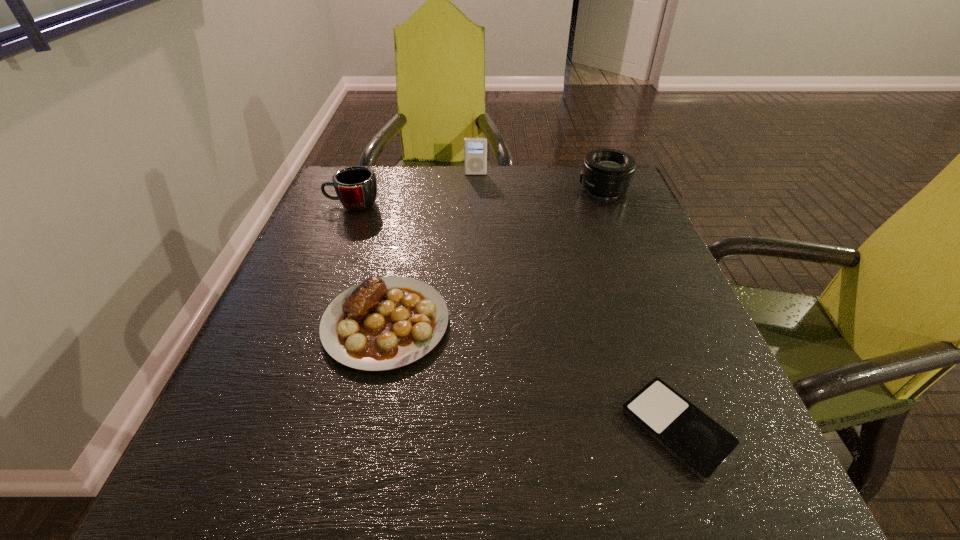
At what (x,y) coordinates should I click in order to perform the action: click on the third object from right to left. Please return your answer as a coordinate pair (x, y). Image resolution: width=960 pixels, height=540 pixels. Looking at the image, I should click on (475, 149).

This screenshot has width=960, height=540. In order to click on the left iPod in this screenshot , I will do `click(475, 149)`.

Find the location of a particular element. The height and width of the screenshot is (540, 960). telephoto lens is located at coordinates (607, 173).

You are a GUI agent. You are given a task and a screenshot of the screen. Output one action in this format:
    pyautogui.click(x=<x>, y=<y>)
    Task: Click on the mug
    The height and width of the screenshot is (540, 960).
    Given the screenshot: What is the action you would take?
    pyautogui.click(x=356, y=187)

Identify the location of steak. (383, 323).

Image resolution: width=960 pixels, height=540 pixels. Identify the location of the fourth farthest object. (383, 323).

This screenshot has width=960, height=540. I want to click on the right iPod, so click(x=701, y=444).

Find the location of a particular element. the shortest object is located at coordinates (701, 444).

Image resolution: width=960 pixels, height=540 pixels. I want to click on free point located on the front-facing side of the left iPod, so click(475, 205).

I want to click on free space located on the side of the telephoto lens with brand markings and control switches, so click(x=485, y=189).